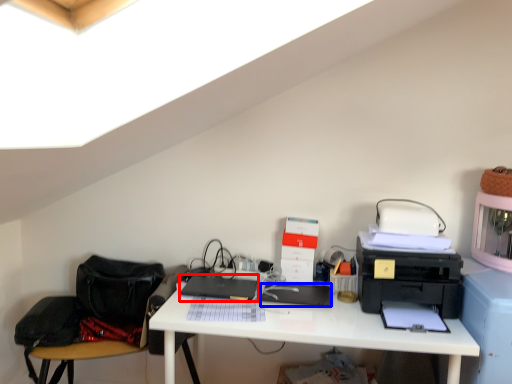
Question: Among these objects, which one is nearest to the camera, laptop (highlighted by a red box) or register (highlighted by a blue box)?

Choices:
 (A) laptop
 (B) register

Answer: (B)